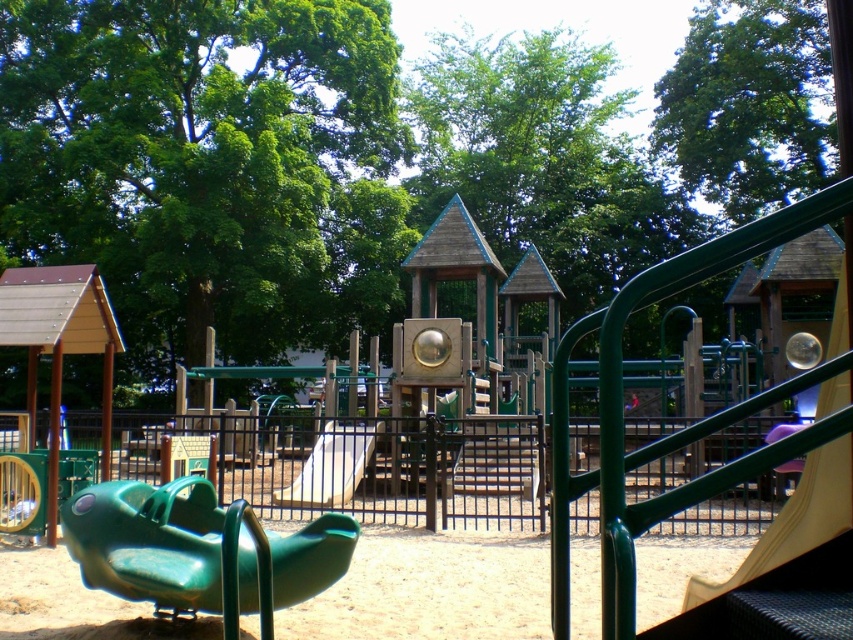
Between point (132, 529) and point (341, 497), which one is positioned behind?

Point (341, 497)

Does green plastic slide at lower left have a greater width compared to white matte slide at center?

Yes.

Who is more distant from viewer, (x=136, y=518) or (x=341, y=461)?

The point (x=341, y=461) is more distant.

Image resolution: width=853 pixels, height=640 pixels. Identify the location of green plastic slide at lower left. (149, 541).